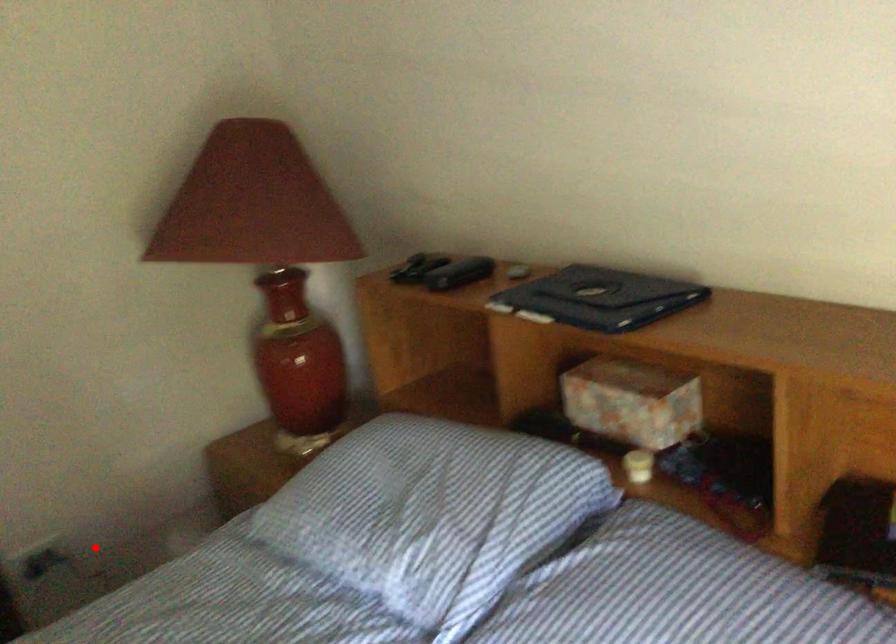
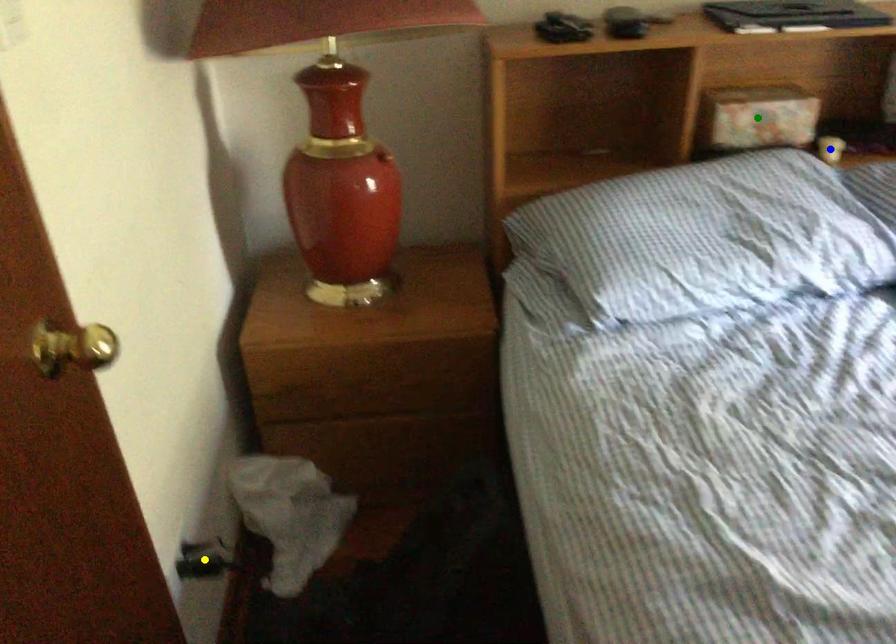
Question: I am providing you with two images of the same scene from different viewpoints. A red point is marked on the first image. You are given multiple points on the second image. Which point in image 2 represents the same 3d spot as the red point in image 1?

Choices:
 (A) yellow point
 (B) blue point
 (C) green point

Answer: (A)